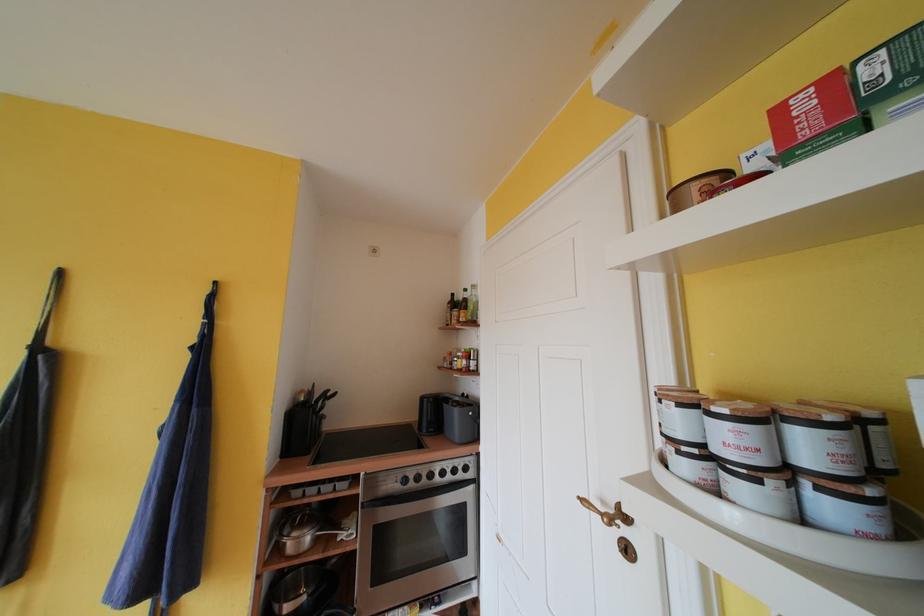
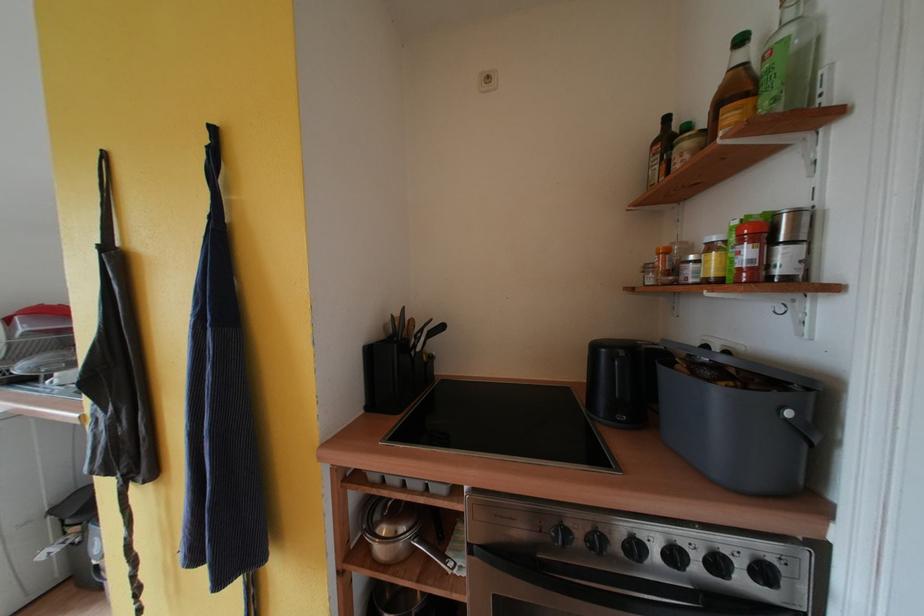
In the second image, find the point that corresponds to point 448,477 in the first image.

(681, 560)